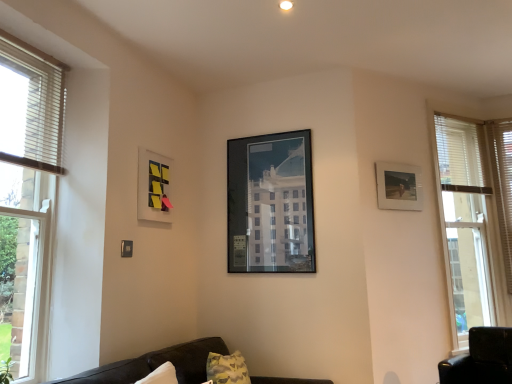
Question: Considering their positions, is clear glass window at left located in front of or behind white textured blind at right, which appears as the first blind when viewed from the right?

Choices:
 (A) front
 (B) behind

Answer: (A)

Question: Is clear glass window at left to the left or to the right of white textured blind at right, acting as the 1th blind starting from the back, in the image?

Choices:
 (A) left
 (B) right

Answer: (A)

Question: Estimate the real-world distances between objects in this image. Which object is farther from the white textured blind at right, acting as the 1th blind starting from the back?

Choices:
 (A) white wood blinds at left, marked as the second blind in a back-to-front arrangement
 (B) matte wooden picture frame at right, placed as the 3th picture frame when sorted from left to right
 (C) dark brown leather couch at lower center
 (D) matte plastic picture frame at upper left, acting as the first picture frame starting from the left
 (E) clear glass window at left

Answer: (E)

Question: Which object is the farthest from the white wood blinds at left, marked as the second blind in a back-to-front arrangement?

Choices:
 (A) matte wooden picture frame at right, placed as the 3th picture frame when sorted from left to right
 (B) matte plastic picture frame at upper left, which appears as the 3th picture frame when viewed from the right
 (C) white textured blind at right, acting as the 1th blind starting from the back
 (D) matte glass picture frame at center, the second picture frame from the left
 (E) clear glass window at left

Answer: (C)